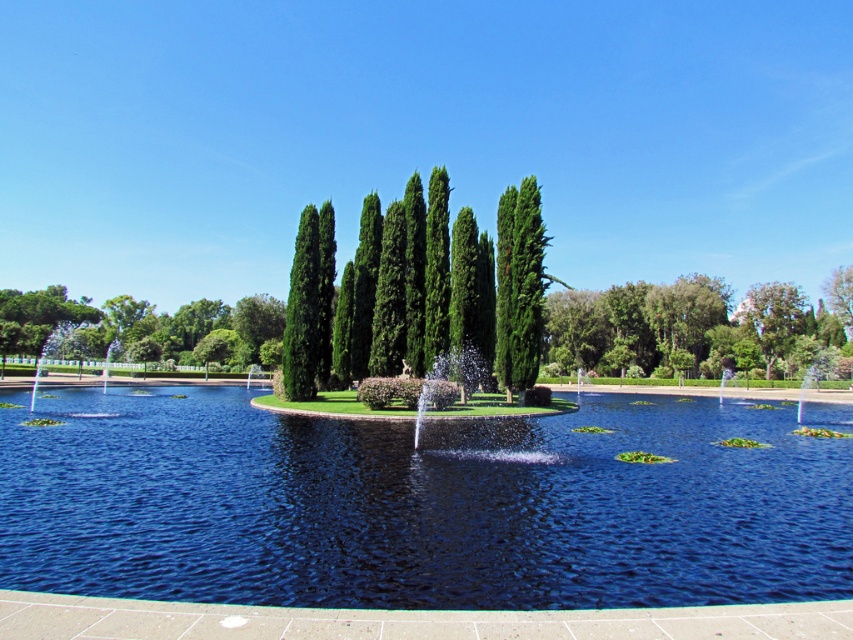
Question: From the image, what is the correct spatial relationship of green leafy tree at center in relation to green glossy trees at center?

Choices:
 (A) left
 (B) right

Answer: (B)

Question: Which is farther from the green glossy tree at upper center?

Choices:
 (A) green leafy tree at center
 (B) clear blue water at center
 (C) green glossy trees at center
 (D) white glossy fountain at left

Answer: (B)

Question: Is clear blue water at center above green leafy tree at center?

Choices:
 (A) yes
 (B) no

Answer: (B)

Question: Among these points, which one is nearest to the camera?

Choices:
 (A) (231, 460)
 (B) (99, 340)

Answer: (A)

Question: Does green leafy tree at center have a greater width compared to white glossy fountain at left?

Choices:
 (A) yes
 (B) no

Answer: (A)

Question: Which object is positioned closest to the green glossy trees at center?

Choices:
 (A) green glossy tree at upper center
 (B) green leafy tree at center

Answer: (B)